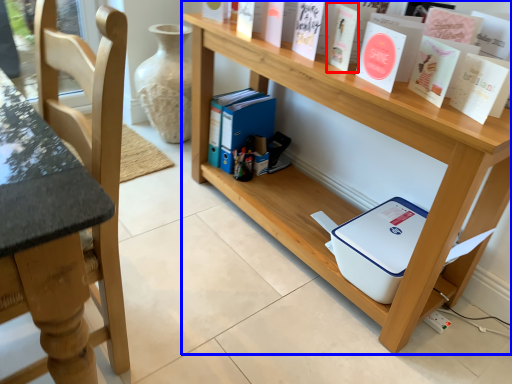
Question: Among these objects, which one is nearest to the camera, paperback book (highlighted by a red box) or shelf (highlighted by a blue box)?

Choices:
 (A) paperback book
 (B) shelf

Answer: (B)